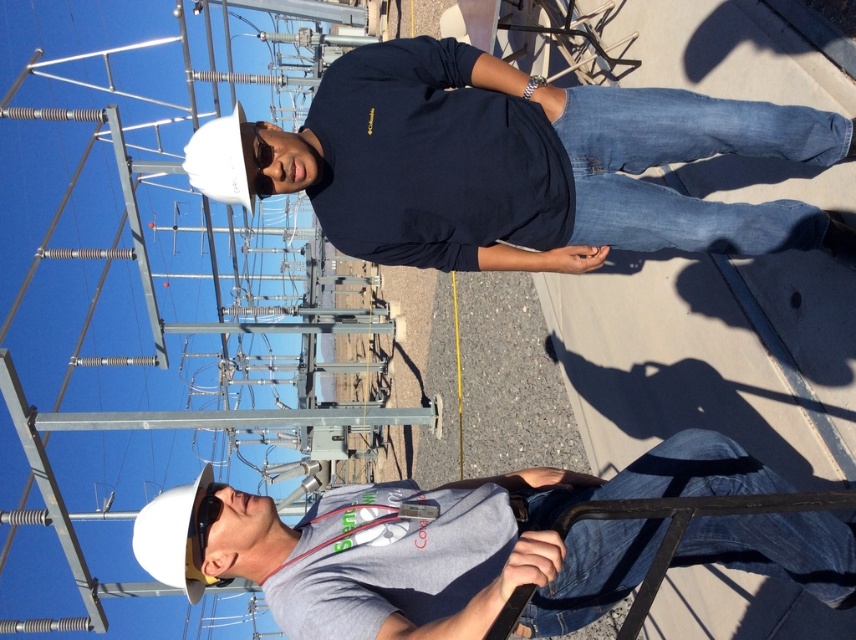
You are a safety inspector at the substation. You need to ensure that all workers are visible from the control room. The control room has a camera facing the center of the scene. Which worker, the dark blue shirt at center or the gray matte shirt at center, is more likely to be visible to the camera?

The dark blue shirt at center is positioned over gray matte shirt at center, so the dark blue shirt at center is more likely to be visible to the camera since it is in front.

In the scene shown: You are a technician at the electrical substation and need to determine the closest point to the camera between the two points marked as point (x=423, y=86) and point (x=263, y=536). Which point is closer?

Point (x=263, y=536) is closer to the camera than point (x=423, y=86).